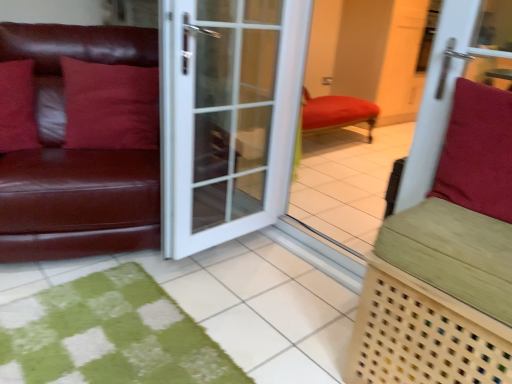
Question: From a real-world perspective, is matte red pillow at left, marked as the third pillow in a front-to-back arrangement, positioned above or below matte leather couch at left?

Choices:
 (A) below
 (B) above

Answer: (B)

Question: Is point (118, 89) positioned closer to the camera than point (94, 190)?

Choices:
 (A) closer
 (B) farther

Answer: (B)

Question: Which of these objects is positioned closest to the suede-like red cushion at right, the third pillow in the left-to-right sequence?

Choices:
 (A) matte leather pillow at left, which ranks as the third pillow in right-to-left order
 (B) matte red pillow at left, the 2th pillow from the right
 (C) matte leather couch at left
 (D) green woven bench at right
 (E) white glass door at center

Answer: (D)

Question: Estimate the real-world distances between objects in this image. Which object is closer to the suede-like red cushion at right, arranged as the third pillow when viewed from the back?

Choices:
 (A) green woven bench at right
 (B) white glass door at center
 (C) matte red pillow at left, placed as the second pillow when sorted from left to right
 (D) matte leather couch at left
 (E) matte leather pillow at left, the first pillow when ordered from left to right

Answer: (A)